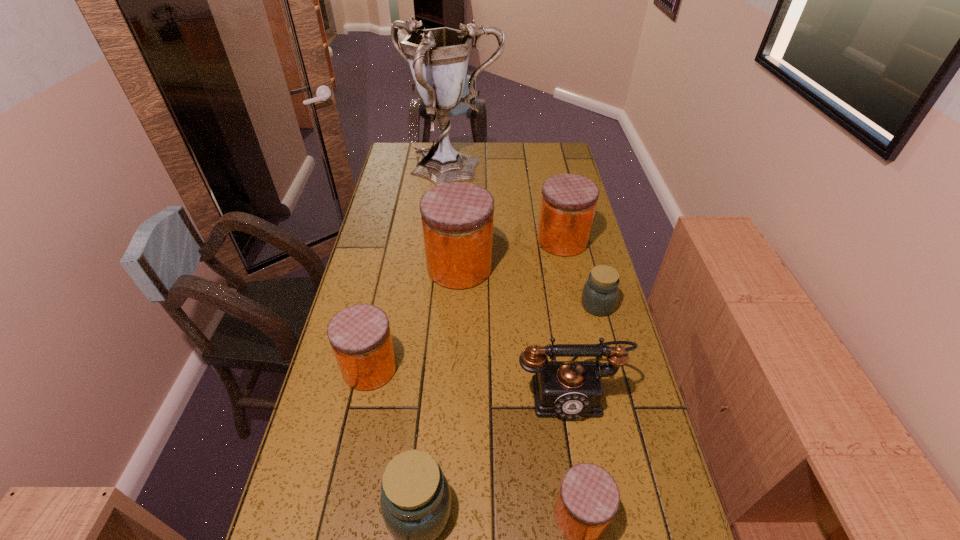
Where is `trophy cup`? trophy cup is located at coordinates (438, 58).

Identify the location of the farthest object. Image resolution: width=960 pixels, height=540 pixels. (438, 58).

Identify the location of the tallest jar. The image size is (960, 540). (457, 218).

Locate an element on the screen. This screenshot has width=960, height=540. the third orange jar from right to left is located at coordinates (457, 218).

Locate an element on the screen. the third smallest orange jar is located at coordinates pos(568,204).

This screenshot has width=960, height=540. Identify the location of gray telephone. (567, 389).

The width and height of the screenshot is (960, 540). Find the location of `the second smallest orange jar`. the second smallest orange jar is located at coordinates (360, 336).

The image size is (960, 540). What are the coordinates of `the third farthest orange jar` in the screenshot? It's located at (360, 336).

You are a GUI agent. You are given a task and a screenshot of the screen. Output one action in this format:
    pyautogui.click(x=<x>, y=<y>)
    Task: Click on the third farthest jar
    The height and width of the screenshot is (540, 960).
    Given the screenshot: What is the action you would take?
    pyautogui.click(x=600, y=293)

Locate an element on the screen. The height and width of the screenshot is (540, 960). the right green jar is located at coordinates (600, 293).